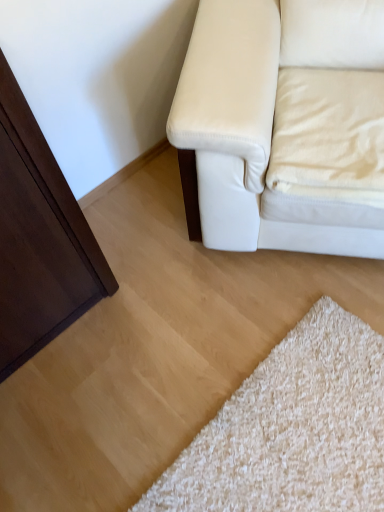
Question: Can you confirm if matte white leather couch at upper right is taller than beige fabric pillow at upper right?

Choices:
 (A) yes
 (B) no

Answer: (A)

Question: Can you confirm if matte white leather couch at upper right is shorter than beige fabric pillow at upper right?

Choices:
 (A) yes
 (B) no

Answer: (B)

Question: Is matte white leather couch at upper right further to the viewer compared to beige fabric pillow at upper right?

Choices:
 (A) yes
 (B) no

Answer: (B)

Question: Are matte white leather couch at upper right and beige fabric pillow at upper right located far from each other?

Choices:
 (A) no
 (B) yes

Answer: (A)

Question: Could you tell me if matte white leather couch at upper right is facing beige fabric pillow at upper right?

Choices:
 (A) yes
 (B) no

Answer: (A)

Question: Considering the relative positions of matte white leather couch at upper right and beige fabric pillow at upper right in the image provided, is matte white leather couch at upper right in front of beige fabric pillow at upper right?

Choices:
 (A) yes
 (B) no

Answer: (A)

Question: Could you tell me if beige fabric pillow at upper right is facing matte white leather couch at upper right?

Choices:
 (A) no
 (B) yes

Answer: (B)

Question: From a real-world perspective, is beige fabric pillow at upper right located beneath matte white leather couch at upper right?

Choices:
 (A) yes
 (B) no

Answer: (A)

Question: Is beige fabric pillow at upper right shorter than matte white leather couch at upper right?

Choices:
 (A) no
 (B) yes

Answer: (B)

Question: Is beige fabric pillow at upper right at the left side of matte white leather couch at upper right?

Choices:
 (A) yes
 (B) no

Answer: (B)

Question: Is the position of beige fabric pillow at upper right more distant than that of matte white leather couch at upper right?

Choices:
 (A) yes
 (B) no

Answer: (A)

Question: Is beige fabric pillow at upper right outside of matte white leather couch at upper right?

Choices:
 (A) yes
 (B) no

Answer: (B)

Question: In terms of height, does matte white leather couch at upper right look taller or shorter compared to beige fabric pillow at upper right?

Choices:
 (A) tall
 (B) short

Answer: (A)